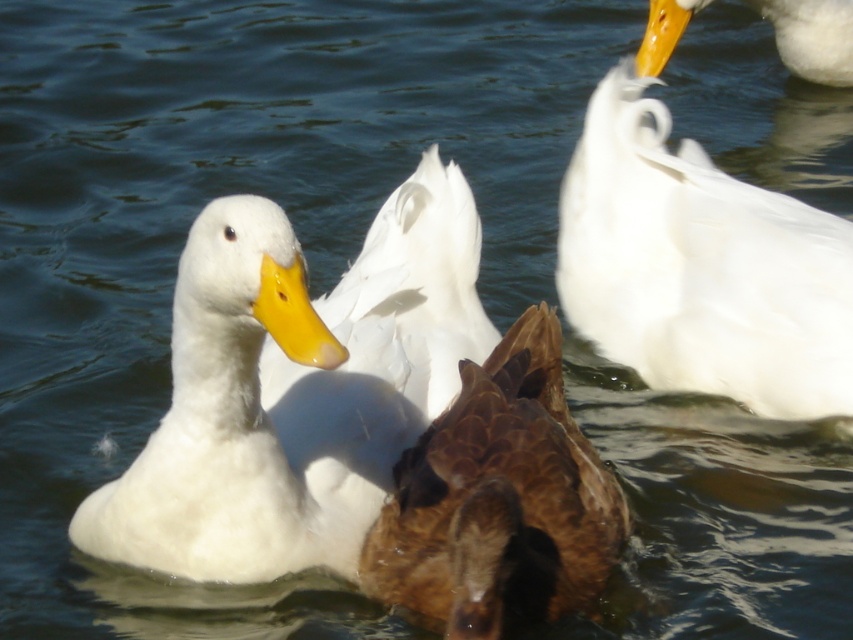
You are standing on a wooden dock and see the white fluffy duck at center swimming in the water. If you want to throw a small pebble to reach the duck, will the distance be manageable for an average adult?

The white fluffy duck at center is 2.26 meters away from viewer, so an average adult can easily throw a pebble to reach it since this distance is within typical throwing range.